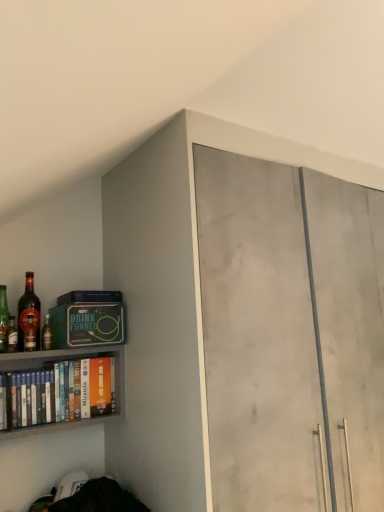
Measure the distance between point (8, 341) and camera.

Point (8, 341) is 4.63 feet away from camera.

Where is `white matte book at left`? Image resolution: width=384 pixels, height=512 pixels. white matte book at left is located at coordinates (62, 394).

The width and height of the screenshot is (384, 512). Describe the element at coordinates (175, 295) in the screenshot. I see `matte concrete cabinet at upper right` at that location.

This screenshot has width=384, height=512. Identify the location of matte glass bottle at left, placed as the first bottle when sorted from left to right. (3, 318).

Considering the relative positions of matte concrete cabinet at upper right and shiny glass bottle at left, acting as the 2th bottle starting from the left, in the image provided, is matte concrete cabinet at upper right to the left or to the right of shiny glass bottle at left, acting as the 2th bottle starting from the left,?

Based on their positions, matte concrete cabinet at upper right is located to the right of shiny glass bottle at left, acting as the 2th bottle starting from the left.

In the scene shown: Considering the relative positions of matte concrete cabinet at upper right and shiny glass bottle at left, acting as the 2th bottle starting from the left, in the image provided, is matte concrete cabinet at upper right behind shiny glass bottle at left, acting as the 2th bottle starting from the left,?

No, matte concrete cabinet at upper right is closer to the camera.

Is there a large distance between matte concrete cabinet at upper right and shiny glass bottle at left, marked as the 3th bottle in a right-to-left arrangement?

No.

Does white matte book at left have a lesser width compared to shiny brown glass bottle at left, the 2th bottle in the right-to-left sequence?

In fact, white matte book at left might be wider than shiny brown glass bottle at left, the 2th bottle in the right-to-left sequence.

Who is bigger, white matte book at left or shiny brown glass bottle at left, the 3th bottle in the left-to-right sequence?

With larger size is white matte book at left.

Is white matte book at left in front of or behind shiny brown glass bottle at left, the 3th bottle in the left-to-right sequence, in the image?

white matte book at left is positioned closer to the viewer than shiny brown glass bottle at left, the 3th bottle in the left-to-right sequence.

From the image's perspective, is white matte book at left under shiny brown glass bottle at left, the 2th bottle in the right-to-left sequence?

Yes, from the image's perspective, white matte book at left is beneath shiny brown glass bottle at left, the 2th bottle in the right-to-left sequence.

Is point (8, 325) positioned behind point (178, 366)?

Yes.

From a real-world perspective, is matte glass bottle at left, placed as the first bottle when sorted from left to right, on top of matte concrete cabinet at upper right?

Yes, from a real-world perspective, matte glass bottle at left, placed as the first bottle when sorted from left to right, is over matte concrete cabinet at upper right

From the image's perspective, who appears lower, matte glass bottle at left, placed as the first bottle when sorted from left to right, or matte concrete cabinet at upper right?

matte concrete cabinet at upper right appears lower in the image.

Looking at this image, does matte glass bottle at left, placed as the first bottle when sorted from left to right, turn towards matte concrete cabinet at upper right?

No.

Looking at this image, is matte glass bottle at left, placed as the first bottle when sorted from left to right, far away from matte glass bottle at left, which is the 4th bottle from left to right?

They are positioned close to each other.

At what (x,y) coordinates should I click in order to perform the action: click on the 1st bottle located above the matte glass bottle at left, positioned as the first bottle in right-to-left order (from a real-world perspective). Please return your answer as a coordinate pair (x, y). This screenshot has width=384, height=512. Looking at the image, I should click on (3, 318).

Which is closer to the camera, (4, 333) or (44, 336)?

Point (4, 333) is positioned closer to the camera compared to point (44, 336).

Between matte glass bottle at left, the fourth bottle from the right, and matte glass bottle at left, which is the 4th bottle from left to right, which one has smaller width?

matte glass bottle at left, which is the 4th bottle from left to right.

Between matte glass bottle at left, positioned as the first bottle in right-to-left order, and white matte book at left, which one is positioned in front?

white matte book at left is more forward.

Is matte glass bottle at left, which is the 4th bottle from left to right, aimed at white matte book at left?

No, matte glass bottle at left, which is the 4th bottle from left to right, is not oriented towards white matte book at left.

Is there a large distance between matte glass bottle at left, which is the 4th bottle from left to right, and white matte book at left?

matte glass bottle at left, which is the 4th bottle from left to right, is near white matte book at left, not far away.

Between point (46, 341) and point (40, 401), which one is positioned in front?

Positioned in front is point (40, 401).

Is shiny glass bottle at left, acting as the 2th bottle starting from the left, surrounded by shiny brown glass bottle at left, the 2th bottle in the right-to-left sequence?

No, shiny glass bottle at left, acting as the 2th bottle starting from the left, is not inside shiny brown glass bottle at left, the 2th bottle in the right-to-left sequence.

Between point (18, 323) and point (11, 325), which one is positioned in front?

The point (11, 325) is more forward.

Based on the photo, could you tell me if shiny brown glass bottle at left, the 3th bottle in the left-to-right sequence, is facing shiny glass bottle at left, acting as the 2th bottle starting from the left?

No, shiny brown glass bottle at left, the 3th bottle in the left-to-right sequence, does not turn towards shiny glass bottle at left, acting as the 2th bottle starting from the left.

How different are the orientations of shiny brown glass bottle at left, the 3th bottle in the left-to-right sequence, and shiny glass bottle at left, marked as the 3th bottle in a right-to-left arrangement, in degrees?

The facing directions of shiny brown glass bottle at left, the 3th bottle in the left-to-right sequence, and shiny glass bottle at left, marked as the 3th bottle in a right-to-left arrangement, are 5.28 degrees apart.

Can you confirm if matte glass bottle at left, which is the 4th bottle from left to right, is bigger than matte glass bottle at left, the fourth bottle from the right?

Incorrect, matte glass bottle at left, which is the 4th bottle from left to right, is not larger than matte glass bottle at left, the fourth bottle from the right.

Consider the image. Who is more distant, matte glass bottle at left, which is the 4th bottle from left to right, or matte glass bottle at left, the fourth bottle from the right?

Positioned behind is matte glass bottle at left, the fourth bottle from the right.

Visually, is matte glass bottle at left, which is the 4th bottle from left to right, positioned to the left or to the right of matte glass bottle at left, the fourth bottle from the right?

matte glass bottle at left, which is the 4th bottle from left to right, is positioned on matte glass bottle at left, the fourth bottle from the right,'s right side.

Based on the photo, can you tell me how much matte glass bottle at left, positioned as the first bottle in right-to-left order, and matte glass bottle at left, placed as the first bottle when sorted from left to right, differ in facing direction?

There is a 3.21-degree angle between the facing directions of matte glass bottle at left, positioned as the first bottle in right-to-left order, and matte glass bottle at left, placed as the first bottle when sorted from left to right.

At what (x,y) coordinates should I click in order to perform the action: click on bottle that is the 3rd object to the left of the matte concrete cabinet at upper right, starting at the anchor. Please return your answer as a coordinate pair (x, y). The image size is (384, 512). Looking at the image, I should click on (11, 336).

You are a GUI agent. You are given a task and a screenshot of the screen. Output one action in this format:
    pyautogui.click(x=<x>, y=<y>)
    Task: Click on the book in front of the shiny brown glass bottle at left, the 3th bottle in the left-to-right sequence
    
    Given the screenshot: What is the action you would take?
    pyautogui.click(x=62, y=394)

Estimate the real-world distances between objects in this image. Which object is further from matte glass bottle at left, which is the 4th bottle from left to right, matte concrete cabinet at upper right or shiny glass bottle at left, acting as the 2th bottle starting from the left?

Based on the image, matte concrete cabinet at upper right appears to be further to matte glass bottle at left, which is the 4th bottle from left to right.

Looking at the image, which one is located closer to matte concrete cabinet at upper right, matte glass bottle at left, the fourth bottle from the right, or shiny glass bottle at left, acting as the 2th bottle starting from the left?

matte glass bottle at left, the fourth bottle from the right.

Which object lies nearer to the anchor point matte concrete cabinet at upper right, white matte book at left or matte glass bottle at left, placed as the first bottle when sorted from left to right?

Result: The object closer to matte concrete cabinet at upper right is white matte book at left.

Estimate the real-world distances between objects in this image. Which object is closer to white matte book at left, shiny brown glass bottle at left, the 2th bottle in the right-to-left sequence, or matte glass bottle at left, placed as the first bottle when sorted from left to right?

The object closer to white matte book at left is shiny brown glass bottle at left, the 2th bottle in the right-to-left sequence.

Looking at the image, which one is located closer to matte glass bottle at left, positioned as the first bottle in right-to-left order, matte glass bottle at left, the fourth bottle from the right, or matte concrete cabinet at upper right?

The object closer to matte glass bottle at left, positioned as the first bottle in right-to-left order, is matte glass bottle at left, the fourth bottle from the right.

Estimate the real-world distances between objects in this image. Which object is further from shiny glass bottle at left, marked as the 3th bottle in a right-to-left arrangement, white matte book at left or matte glass bottle at left, which is the 4th bottle from left to right?

white matte book at left lies further to shiny glass bottle at left, marked as the 3th bottle in a right-to-left arrangement, than the other object.

Considering their positions, is shiny brown glass bottle at left, the 2th bottle in the right-to-left sequence, positioned further to shiny glass bottle at left, acting as the 2th bottle starting from the left, than matte concrete cabinet at upper right?

Among the two, matte concrete cabinet at upper right is located further to shiny glass bottle at left, acting as the 2th bottle starting from the left.

Which object lies nearer to the anchor point matte concrete cabinet at upper right, shiny glass bottle at left, acting as the 2th bottle starting from the left, or white matte book at left?

white matte book at left lies closer to matte concrete cabinet at upper right than the other object.

The image size is (384, 512). In order to click on book situated between shiny brown glass bottle at left, the 2th bottle in the right-to-left sequence, and matte concrete cabinet at upper right from left to right in this screenshot , I will do `click(62, 394)`.

I want to click on bottle situated between shiny glass bottle at left, marked as the 3th bottle in a right-to-left arrangement, and matte glass bottle at left, which is the 4th bottle from left to right, from left to right, so click(x=29, y=317).

At what (x,y) coordinates should I click in order to perform the action: click on bottle that lies between shiny glass bottle at left, acting as the 2th bottle starting from the left, and white matte book at left from top to bottom. Please return your answer as a coordinate pair (x, y). Looking at the image, I should click on (47, 334).

At what (x,y) coordinates should I click in order to perform the action: click on bottle between shiny brown glass bottle at left, the 3th bottle in the left-to-right sequence, and matte concrete cabinet at upper right. Please return your answer as a coordinate pair (x, y). The height and width of the screenshot is (512, 384). Looking at the image, I should click on (47, 334).